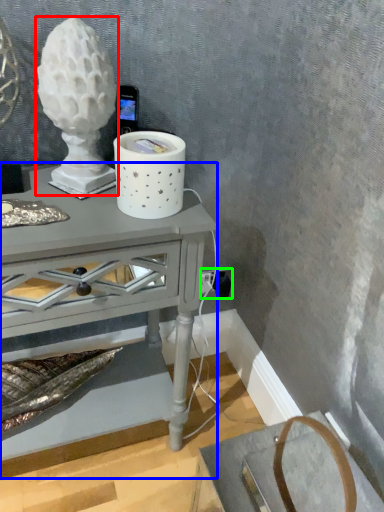
Question: Which object is positioned closest to candle holder (highlighted by a red box)? Select from table (highlighted by a blue box) and electric outlet (highlighted by a green box).

Choices:
 (A) table
 (B) electric outlet

Answer: (A)